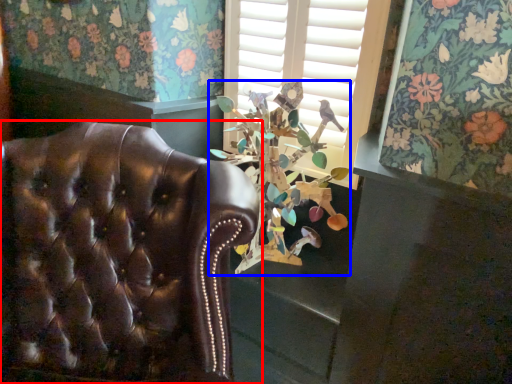
Question: Which point is closer to the camera, chair (highlighted by a red box) or floral arrangement (highlighted by a blue box)?

Choices:
 (A) chair
 (B) floral arrangement

Answer: (A)